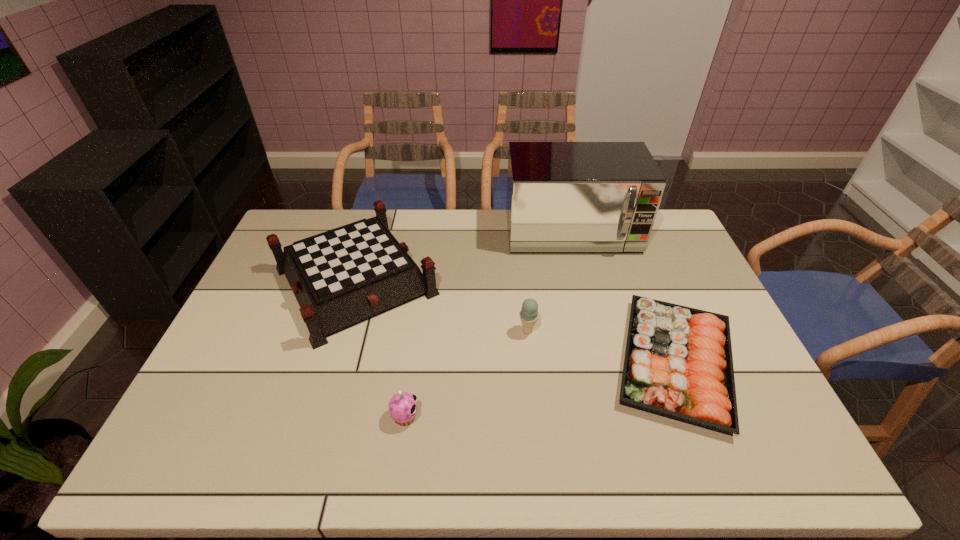
Identify the location of microwave oven. (561, 196).

Where is `checkerboard`? checkerboard is located at coordinates (339, 277).

Locate an element on the screen. The image size is (960, 540). ice cream is located at coordinates (529, 315).

This screenshot has height=540, width=960. What are the coordinates of `cupcake` in the screenshot? It's located at (403, 406).

Locate an element on the screen. This screenshot has width=960, height=540. platter is located at coordinates (678, 364).

Where is `vacant space located 0.360m with the door open on the tallest object`? vacant space located 0.360m with the door open on the tallest object is located at coordinates (599, 343).

Where is `vacant space located on the back of the checkerboard`? vacant space located on the back of the checkerboard is located at coordinates (376, 212).

The image size is (960, 540). Find the location of `vacant space located 0.400m on the left of the ice cream`. vacant space located 0.400m on the left of the ice cream is located at coordinates (379, 331).

Locate an element on the screen. This screenshot has width=960, height=540. free space located 0.330m on the face of the cupcake is located at coordinates (555, 417).

At what (x,y) coordinates should I click in order to perform the action: click on free space located on the back of the platter. Please return your answer as a coordinate pair (x, y). Looking at the image, I should click on pos(635,260).